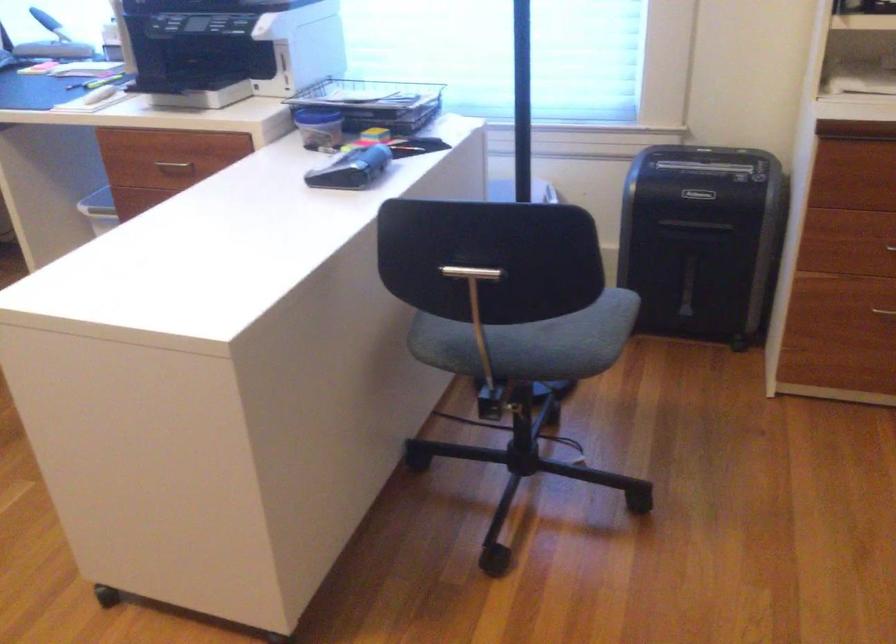
This screenshot has width=896, height=644. I want to click on metal T-handle, so click(476, 308).